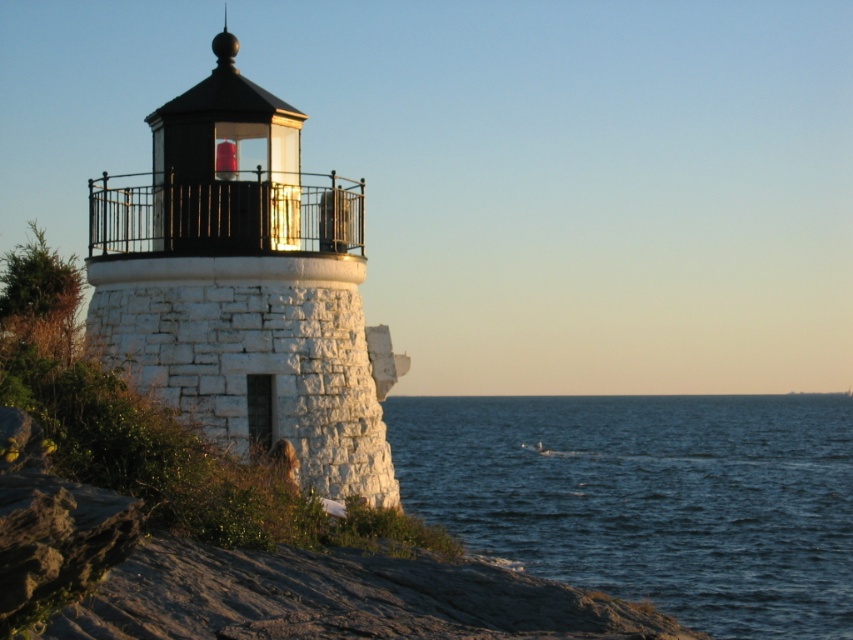
Question: From the image, what is the correct spatial relationship of blue water at lower right in relation to white stone lighthouse at center?

Choices:
 (A) above
 (B) below

Answer: (B)

Question: Among these objects, which one is nearest to the camera?

Choices:
 (A) blue water at lower right
 (B) white stone lighthouse at center

Answer: (B)

Question: Which point is closer to the camera?

Choices:
 (A) blue water at lower right
 (B) white stone lighthouse at center

Answer: (B)

Question: Which object appears farthest from the camera in this image?

Choices:
 (A) blue water at lower right
 (B) white stone lighthouse at center

Answer: (A)

Question: Does blue water at lower right appear over white stone lighthouse at center?

Choices:
 (A) yes
 (B) no

Answer: (B)

Question: Is blue water at lower right above white stone lighthouse at center?

Choices:
 (A) no
 (B) yes

Answer: (A)